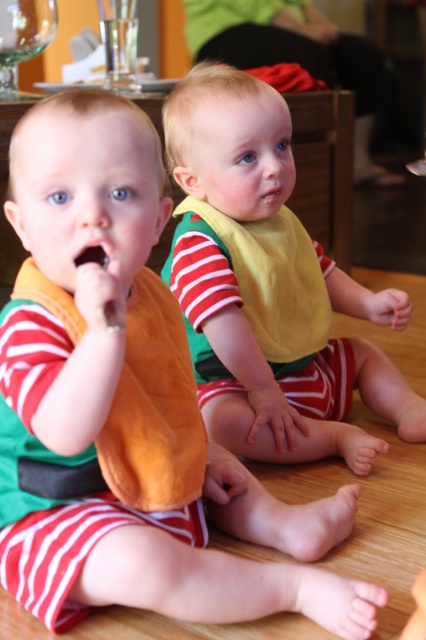
Does yellow fabric bib at center have a smaller size compared to transparent glass at upper left?

No.

Does point (287, 428) come behind point (6, 12)?

No.

The height and width of the screenshot is (640, 426). What are the coordinates of `yellow fabric bib at center` in the screenshot? It's located at (275, 310).